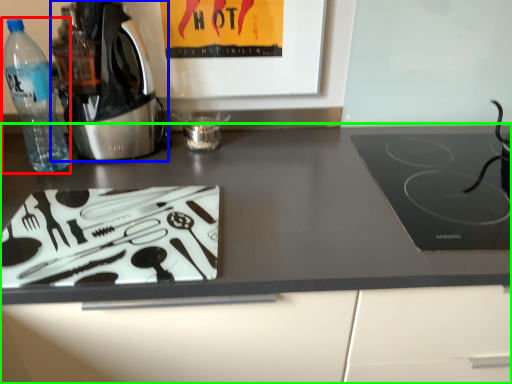
Question: Based on their relative distances, which object is farther from bottle (highlighted by a red box)? Choose from home appliance (highlighted by a blue box) and countertop (highlighted by a green box).

Choices:
 (A) home appliance
 (B) countertop

Answer: (B)